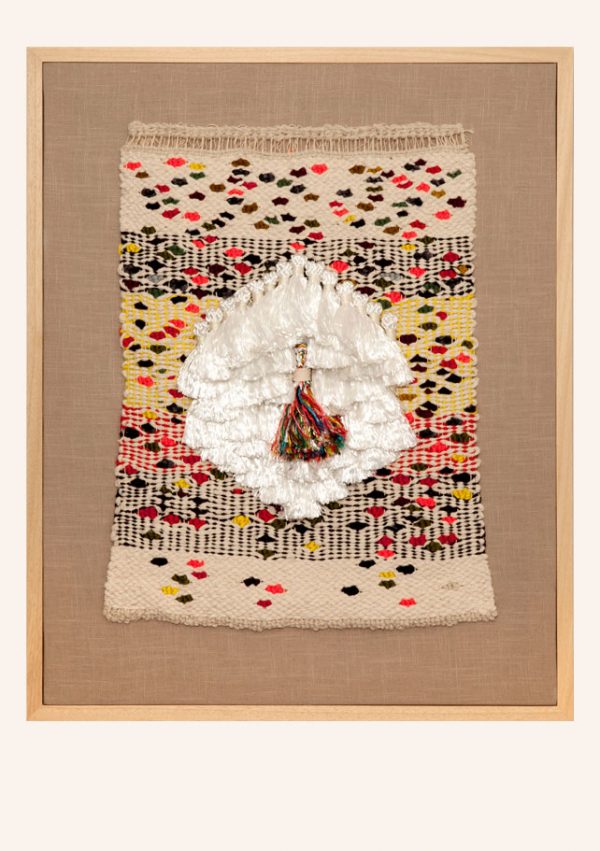
The height and width of the screenshot is (851, 600). I want to click on tapestry, so click(419, 557).